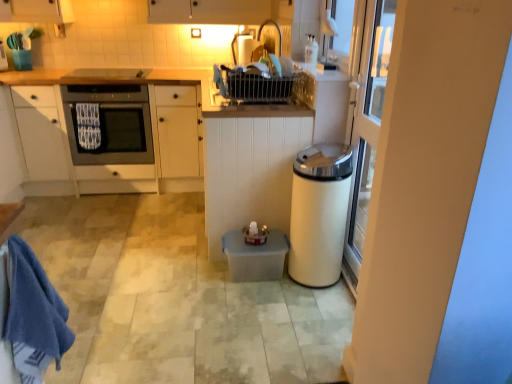
Question: From a real-world perspective, is white glossy trash can at right positioned above or below blue cotton towel at lower left, marked as the 1th bath towel in a bottom-to-top arrangement?

Choices:
 (A) above
 (B) below

Answer: (B)

Question: Would you say white glossy trash can at right is inside or outside blue cotton towel at lower left, placed as the 1th bath towel when sorted from front to back?

Choices:
 (A) outside
 (B) inside

Answer: (A)

Question: Estimate the real-world distances between objects in this image. Which object is farther from the translucent plastic container at center?

Choices:
 (A) white glossy trash can at right
 (B) blue cotton towel at lower left, which is the second bath towel from back to front
 (C) white matte cabinet at left, positioned as the 2th cabinetry in right-to-left order
 (D) white matte cabinet at center, positioned as the 2th cabinetry in left-to-right order
 (E) matte black oven at upper center

Answer: (E)

Question: Which object is positioned closest to the matte black oven at left?

Choices:
 (A) matte black oven at upper center
 (B) white matte cabinet at left, positioned as the 2th cabinetry in right-to-left order
 (C) translucent plastic container at center
 (D) white glossy trash can at right
 (E) white textured bath towel at left, which is the 2th bath towel from front to back

Answer: (B)